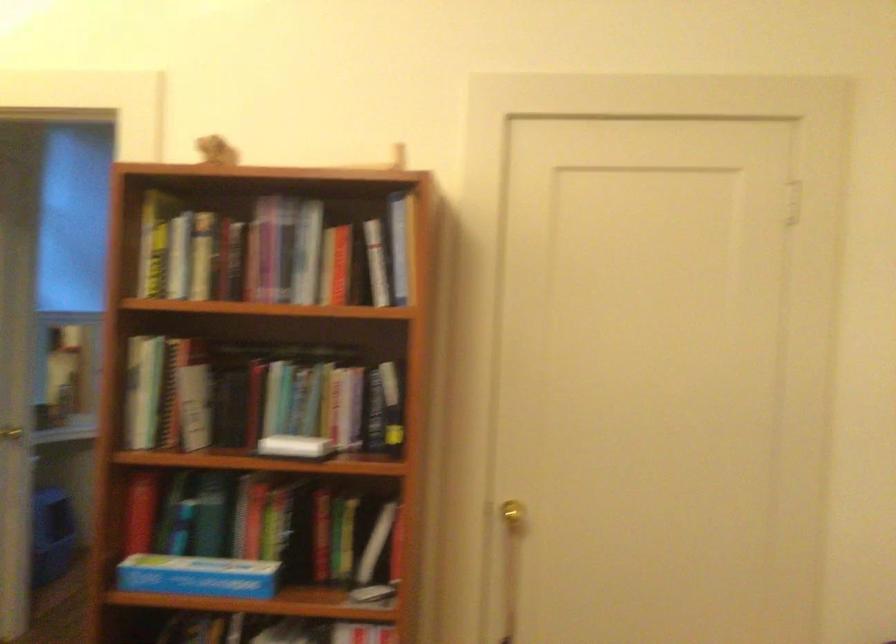
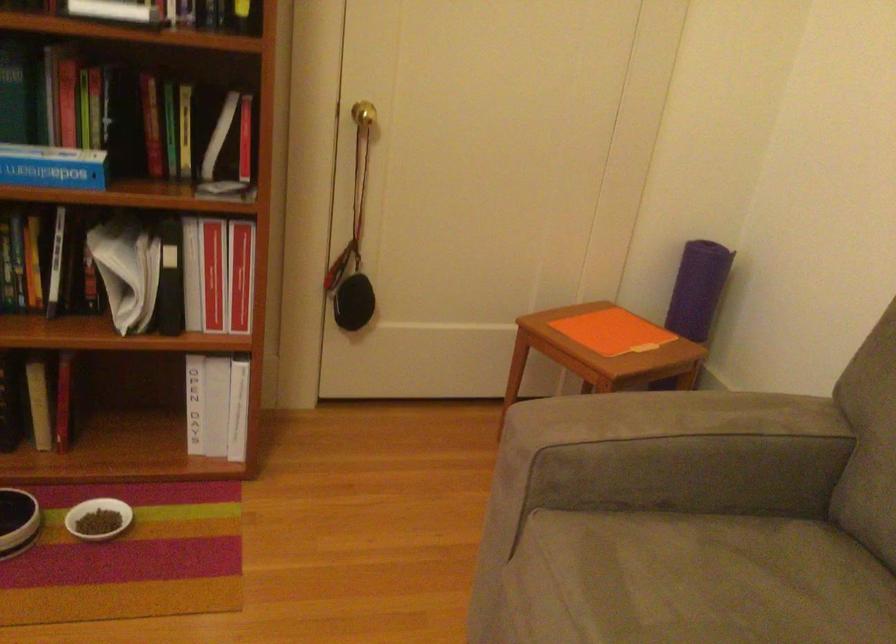
How did the camera likely rotate?

The camera rotated toward right-down.